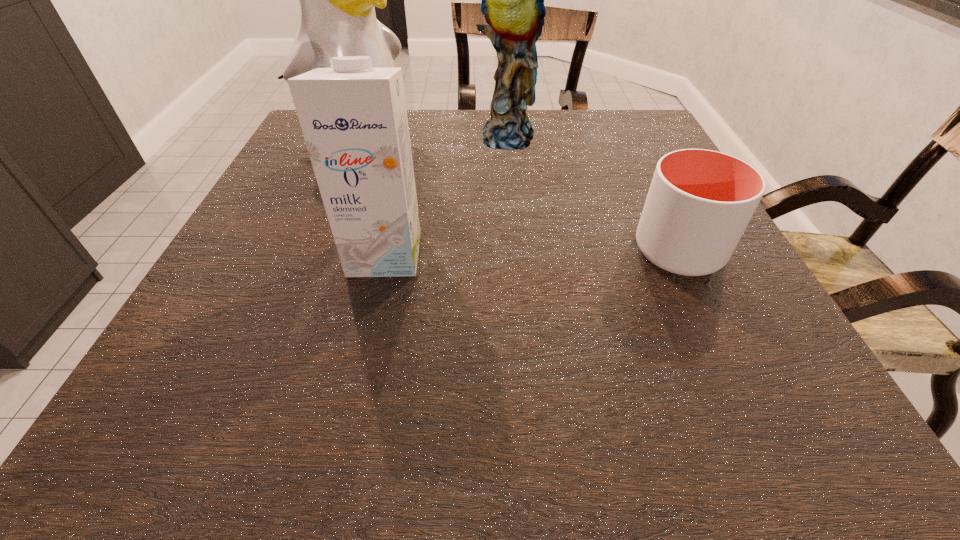
This screenshot has width=960, height=540. What are the coordinates of `carton` in the screenshot? It's located at (353, 117).

This screenshot has width=960, height=540. I want to click on the shortest object, so click(x=699, y=203).

Find the location of `the rightmost object`. the rightmost object is located at coordinates (699, 203).

Where is `parrot`? This screenshot has height=540, width=960. parrot is located at coordinates (512, 0).

In order to click on gull in this screenshot , I will do `click(337, 15)`.

At what (x,y) coordinates should I click in order to perform the action: click on vacant region located 0.370m on the right of the second shortest object. Please return your answer as a coordinate pair (x, y). Looking at the image, I should click on (628, 254).

At what (x,y) coordinates should I click in order to perform the action: click on vacant space located on the front of the rightmost object. Please return your answer as a coordinate pair (x, y). Looking at the image, I should click on (730, 357).

Find the location of `vacant region located 0.220m on the face of the third object from left to right`. vacant region located 0.220m on the face of the third object from left to right is located at coordinates (523, 215).

Find the location of a particular element. Image resolution: width=960 pixels, height=540 pixels. vacant space situated 0.390m on the face of the third object from left to right is located at coordinates [x=537, y=276].

Image resolution: width=960 pixels, height=540 pixels. I want to click on vacant region located on the face of the third object from left to right, so click(x=521, y=206).